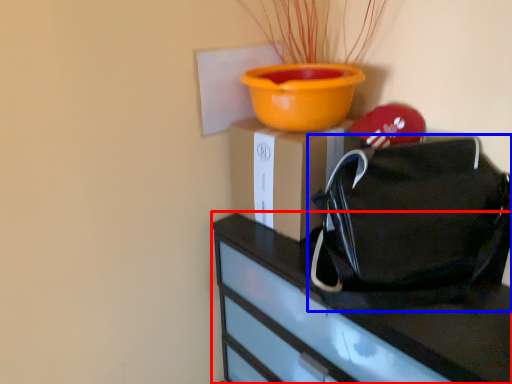
Question: Which point is closer to the camera, furniture (highlighted by a red box) or handbag (highlighted by a blue box)?

Choices:
 (A) furniture
 (B) handbag

Answer: (A)